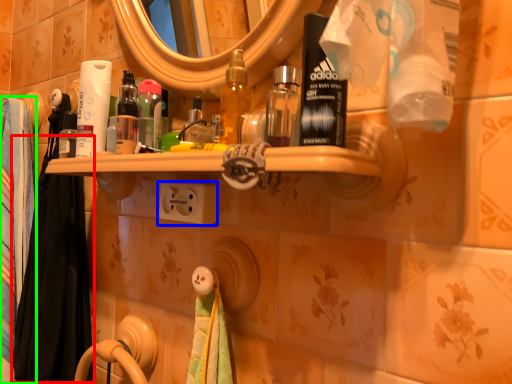
Question: Estimate the real-world distances between objects in this image. Which object is farther from bath towel (highlighted by a red box), electric outlet (highlighted by a blue box) or bath towel (highlighted by a green box)?

Choices:
 (A) electric outlet
 (B) bath towel

Answer: (A)